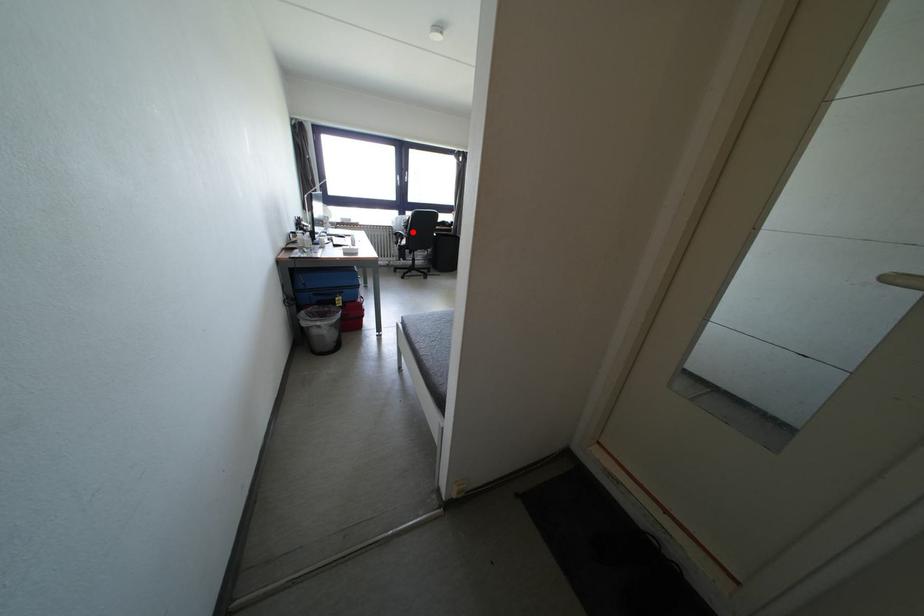
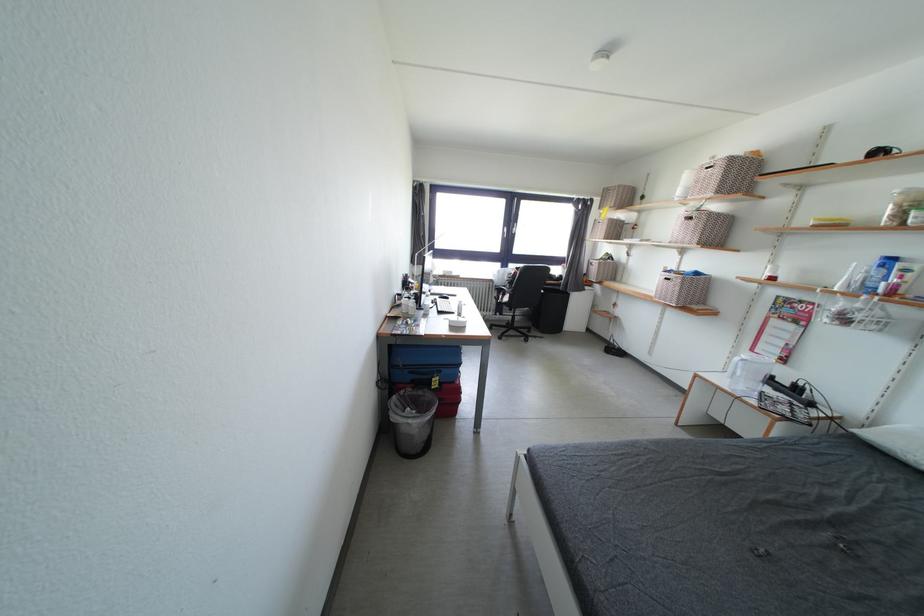
The point at the highlighted location is marked in the first image. Where is the corresponding point in the second image?

(517, 286)